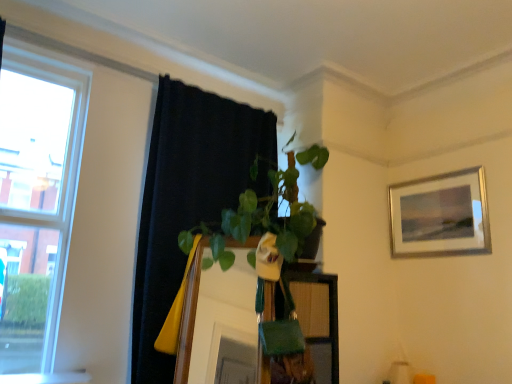
Where is `silver metallic picture frame at upper right`? This screenshot has height=384, width=512. silver metallic picture frame at upper right is located at coordinates (440, 215).

You are a GUI agent. You are given a task and a screenshot of the screen. Output one action in this format:
    pyautogui.click(x=<x>, y=<y>)
    Task: Click on the black fabric curtain at upper left
    This screenshot has width=512, height=384.
    Given the screenshot: What is the action you would take?
    pyautogui.click(x=188, y=198)

In the image, is clear glass window at left positioned in front of or behind wooden mirror at center?

In the image, clear glass window at left appears in front of wooden mirror at center.

Can you confirm if clear glass window at left is taller than wooden mirror at center?

Yes, clear glass window at left is taller than wooden mirror at center.

From the image's perspective, is clear glass window at left beneath wooden mirror at center?

No.

From a real-world perspective, which object rests below the other?

white glossy window sill at lower left, from a real-world perspective.

Considering the sizes of silver metallic picture frame at upper right and white glossy window sill at lower left in the image, is silver metallic picture frame at upper right taller or shorter than white glossy window sill at lower left?

silver metallic picture frame at upper right is taller than white glossy window sill at lower left.

Which is closer, (431, 216) or (61, 375)?

The point (61, 375) is in front.

Can you confirm if white glossy window sill at lower left is wider than silver metallic picture frame at upper right?

Yes, white glossy window sill at lower left is wider than silver metallic picture frame at upper right.

Considering the relative sizes of white glossy window sill at lower left and silver metallic picture frame at upper right in the image provided, is white glossy window sill at lower left shorter than silver metallic picture frame at upper right?

Indeed, white glossy window sill at lower left has a lesser height compared to silver metallic picture frame at upper right.

From a real-world perspective, is white glossy window sill at lower left physically located above or below silver metallic picture frame at upper right?

Clearly, from a real-world perspective, white glossy window sill at lower left is below silver metallic picture frame at upper right.

Can you confirm if white glossy window sill at lower left is bigger than silver metallic picture frame at upper right?

No, white glossy window sill at lower left is not bigger than silver metallic picture frame at upper right.

Would you say silver metallic picture frame at upper right contains clear glass window at left?

No, clear glass window at left is not inside silver metallic picture frame at upper right.

Is silver metallic picture frame at upper right facing towards clear glass window at left?

Yes, silver metallic picture frame at upper right is turned towards clear glass window at left.

From the image's perspective, is silver metallic picture frame at upper right on clear glass window at left?

Actually, silver metallic picture frame at upper right appears below clear glass window at left in the image.

From a real-world perspective, is silver metallic picture frame at upper right physically located above or below clear glass window at left?

In terms of real-world spatial position, silver metallic picture frame at upper right is above clear glass window at left.

Considering the sizes of wooden mirror at center and white glossy window sill at lower left in the image, is wooden mirror at center bigger or smaller than white glossy window sill at lower left?

In the image, wooden mirror at center appears to be larger than white glossy window sill at lower left.

Which object is wider, wooden mirror at center or white glossy window sill at lower left?

wooden mirror at center is wider.

Is wooden mirror at center to the left of white glossy window sill at lower left from the viewer's perspective?

Incorrect, wooden mirror at center is not on the left side of white glossy window sill at lower left.

Looking at this image, is wooden mirror at center at the left side of silver metallic picture frame at upper right?

Correct, you'll find wooden mirror at center to the left of silver metallic picture frame at upper right.

Between wooden mirror at center and silver metallic picture frame at upper right, which one has smaller width?

silver metallic picture frame at upper right is thinner.

From the picture: Is wooden mirror at center closer to camera compared to silver metallic picture frame at upper right?

Yes, wooden mirror at center is closer to the viewer.

Does point (60, 372) lie behind point (151, 266)?

No, (60, 372) is closer to viewer.

From a real-world perspective, is white glossy window sill at lower left over black fabric curtain at upper left?

No, from a real-world perspective, white glossy window sill at lower left is not on top of black fabric curtain at upper left.

Which of these two, white glossy window sill at lower left or black fabric curtain at upper left, is wider?

black fabric curtain at upper left.

Locate an element on the screen. The image size is (512, 384). window sill below the black fabric curtain at upper left (from the image's perspective) is located at coordinates (47, 378).

Identify the location of mirror lying on the right of clear glass window at left. The height and width of the screenshot is (384, 512). (214, 309).

Find the location of a particular element. picture frame located above the white glossy window sill at lower left (from the image's perspective) is located at coordinates [x=440, y=215].

Based on their spatial positions, is clear glass window at left or white glossy window sill at lower left closer to black fabric curtain at upper left?

Among the two, clear glass window at left is located nearer to black fabric curtain at upper left.

When comparing their distances from black fabric curtain at upper left, does clear glass window at left or wooden mirror at center seem closer?

wooden mirror at center is closer to black fabric curtain at upper left.

Based on their spatial positions, is wooden mirror at center or black fabric curtain at upper left closer to silver metallic picture frame at upper right?

The object closer to silver metallic picture frame at upper right is wooden mirror at center.

Looking at the image, which one is located further to wooden mirror at center, black fabric curtain at upper left or silver metallic picture frame at upper right?

Among the two, silver metallic picture frame at upper right is located further to wooden mirror at center.

When comparing their distances from white glossy window sill at lower left, does wooden mirror at center or clear glass window at left seem further?

The object further to white glossy window sill at lower left is wooden mirror at center.

From the image, which object appears to be nearer to wooden mirror at center, white glossy window sill at lower left or clear glass window at left?

Based on the image, white glossy window sill at lower left appears to be nearer to wooden mirror at center.

When comparing their distances from white glossy window sill at lower left, does silver metallic picture frame at upper right or black fabric curtain at upper left seem closer?

black fabric curtain at upper left is positioned closer to the anchor white glossy window sill at lower left.

From the picture: Looking at the image, which one is located further to white glossy window sill at lower left, wooden mirror at center or black fabric curtain at upper left?

Among the two, black fabric curtain at upper left is located further to white glossy window sill at lower left.

Find the location of a particular element. curtain between white glossy window sill at lower left and wooden mirror at center from left to right is located at coordinates (188, 198).

This screenshot has height=384, width=512. I want to click on curtain between clear glass window at left and wooden mirror at center from left to right, so click(188, 198).

Locate an element on the screen. The width and height of the screenshot is (512, 384). mirror between clear glass window at left and silver metallic picture frame at upper right in the horizontal direction is located at coordinates (214, 309).

Identify the location of curtain between clear glass window at left and silver metallic picture frame at upper right. (188, 198).